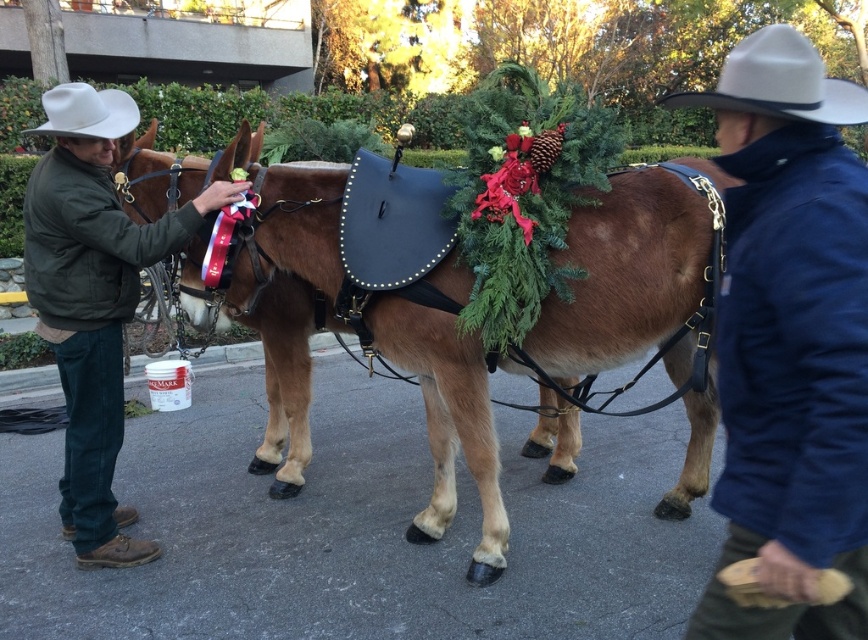
Can you confirm if brown leather saddle at center is smaller than green cotton jacket at left?

Incorrect, brown leather saddle at center is not smaller in size than green cotton jacket at left.

Is point (311, 326) less distant than point (30, 256)?

No, it is behind (30, 256).

At what (x,y) coordinates should I click in order to perform the action: click on brown leather saddle at center. Please return your answer as a coordinate pair (x, y). Looking at the image, I should click on (626, 275).

Who is shorter, blue woolen jacket at right or brown leather saddle at center?

With less height is blue woolen jacket at right.

Is blue woolen jacket at right positioned before brown leather saddle at center?

That is True.

What do you see at coordinates (788, 340) in the screenshot?
I see `blue woolen jacket at right` at bounding box center [788, 340].

Where is `blue woolen jacket at right`? This screenshot has height=640, width=868. blue woolen jacket at right is located at coordinates (788, 340).

Between point (691, 100) and point (68, 124), which one is positioned behind?

Positioned behind is point (68, 124).

Is white felt cowboy hat at upper right wider than white felt cowboy hat at upper left?

Indeed, white felt cowboy hat at upper right has a greater width compared to white felt cowboy hat at upper left.

Find the location of a particular element. The height and width of the screenshot is (640, 868). white felt cowboy hat at upper right is located at coordinates (779, 83).

Locate an element on the screen. white felt cowboy hat at upper right is located at coordinates (779, 83).